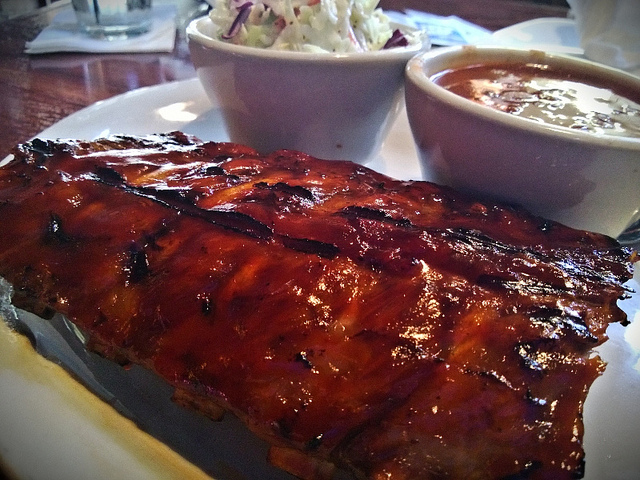
Where is `rim of ramekin of soup`? This screenshot has height=480, width=640. rim of ramekin of soup is located at coordinates (454, 101).